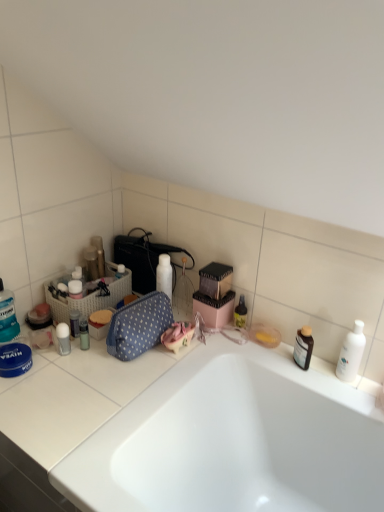
This screenshot has height=512, width=384. I want to click on free space in front of translucent plastic bottle at upper right, the 3th toiletry in the right-to-left sequence, so click(238, 353).